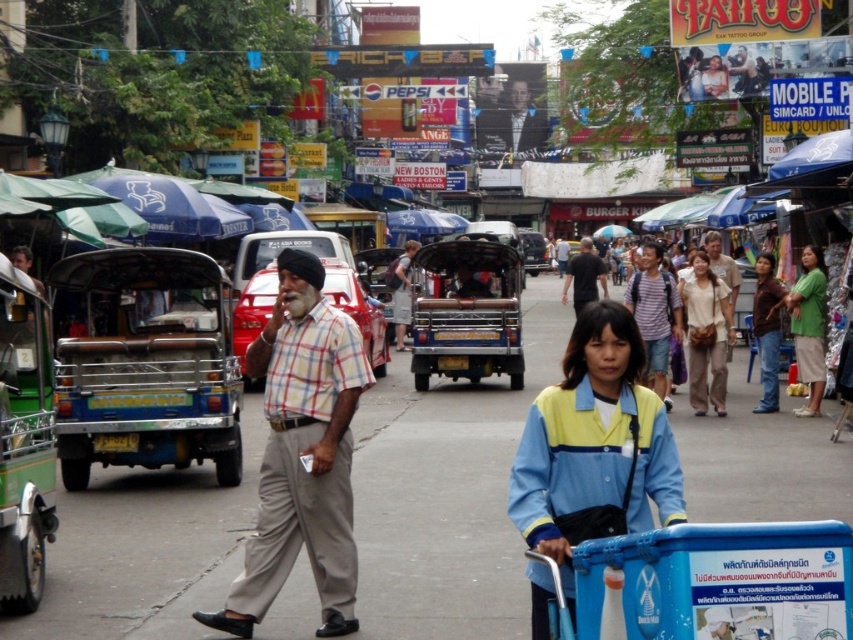
Question: Can you confirm if gray asphalt pavement at center is thinner than metallic blue tuk-tuk at center?

Choices:
 (A) no
 (B) yes

Answer: (A)

Question: Which object is farther from the camera taking this photo?

Choices:
 (A) gray asphalt pavement at center
 (B) light blue fabric shirt at center

Answer: (A)

Question: Which object is positioned closest to the brown matte shirt at center-right?

Choices:
 (A) blue plastic cart at center
 (B) matte gray backpack at center
 (C) light blue fabric shirt at center
 (D) light beige fabric pants at center

Answer: (D)

Question: In this image, where is plaid shirt at center located relative to dark gray shirt at center?

Choices:
 (A) left
 (B) right

Answer: (A)

Question: Is light blue fabric shirt at center thinner than dark gray shirt at center?

Choices:
 (A) yes
 (B) no

Answer: (A)

Question: Which of the following is the farthest from the observer?

Choices:
 (A) light beige fabric pants at center
 (B) light blue fabric shirt at center
 (C) matte gray backpack at center

Answer: (C)